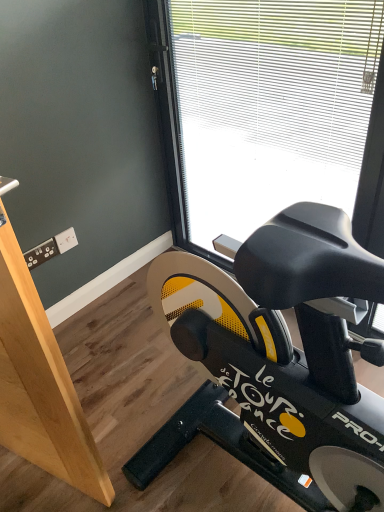
Question: Is light brown wood at left not within black matte stationary bicycle at lower right?

Choices:
 (A) yes
 (B) no

Answer: (A)

Question: Can you confirm if light brown wood at left is positioned to the right of black matte stationary bicycle at lower right?

Choices:
 (A) no
 (B) yes

Answer: (A)

Question: Considering the relative sizes of light brown wood at left and black matte stationary bicycle at lower right in the image provided, is light brown wood at left smaller than black matte stationary bicycle at lower right?

Choices:
 (A) yes
 (B) no

Answer: (B)

Question: From a real-world perspective, is light brown wood at left on top of black matte stationary bicycle at lower right?

Choices:
 (A) yes
 (B) no

Answer: (A)

Question: Is light brown wood at left further to the viewer compared to black matte stationary bicycle at lower right?

Choices:
 (A) no
 (B) yes

Answer: (A)

Question: From the image's perspective, is light brown wood at left below black matte stationary bicycle at lower right?

Choices:
 (A) yes
 (B) no

Answer: (B)

Question: Is black matte stationary bicycle at lower right located outside transparent glass window at center?

Choices:
 (A) yes
 (B) no

Answer: (A)

Question: Could transparent glass window at center be considered to be inside black matte stationary bicycle at lower right?

Choices:
 (A) no
 (B) yes

Answer: (A)

Question: Does black matte stationary bicycle at lower right turn towards transparent glass window at center?

Choices:
 (A) no
 (B) yes

Answer: (A)

Question: Is black matte stationary bicycle at lower right in front of transparent glass window at center?

Choices:
 (A) no
 (B) yes

Answer: (B)

Question: Would you say black matte stationary bicycle at lower right is a long distance from transparent glass window at center?

Choices:
 (A) yes
 (B) no

Answer: (B)

Question: Is black matte stationary bicycle at lower right next to transparent glass window at center and touching it?

Choices:
 (A) no
 (B) yes

Answer: (A)

Question: From a real-world perspective, is transparent glass window at center physically above light brown wood at left?

Choices:
 (A) no
 (B) yes

Answer: (A)